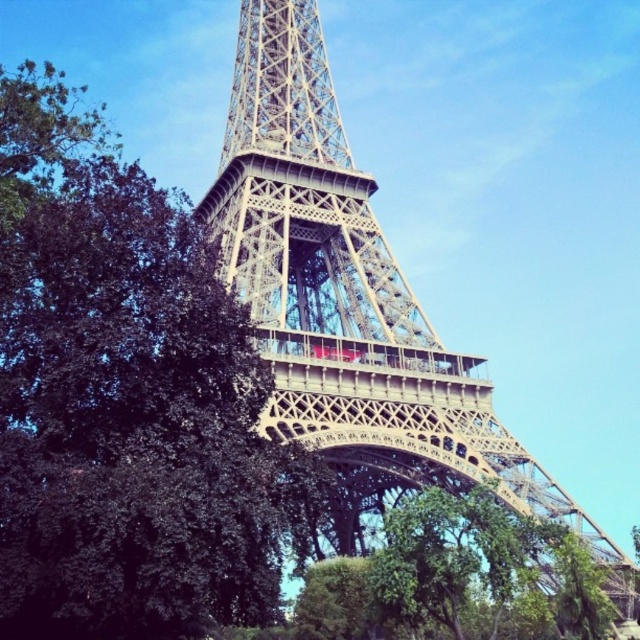
In the scene shown: Does metallic structure at center appear on the left side of green leafy tree at lower center?

Indeed, metallic structure at center is positioned on the left side of green leafy tree at lower center.

Who is shorter, metallic structure at center or green leafy tree at lower center?

Standing shorter between the two is green leafy tree at lower center.

Does point (550, 506) come in front of point (572, 573)?

No.

Where is `metallic structure at center`? metallic structure at center is located at coordinates (349, 296).

Between green leafy tree at center-left and metallic structure at center, which one is positioned higher?

green leafy tree at center-left is above.

Is green leafy tree at center-left closer to the viewer compared to metallic structure at center?

→ Yes.

At what (x,y) coordinates should I click in order to perform the action: click on green leafy tree at center-left. Please return your answer as a coordinate pair (x, y). This screenshot has width=640, height=640. Looking at the image, I should click on (125, 401).

What do you see at coordinates (125, 401) in the screenshot?
I see `green leafy tree at center-left` at bounding box center [125, 401].

Is green leafy tree at center-left positioned at the back of green leafy tree at lower center?

No, green leafy tree at center-left is closer to the viewer.

Is point (10, 337) positioned in front of point (497, 506)?

Yes, point (10, 337) is in front of point (497, 506).

Find the location of `green leafy tree at center-left`. green leafy tree at center-left is located at coordinates (125, 401).